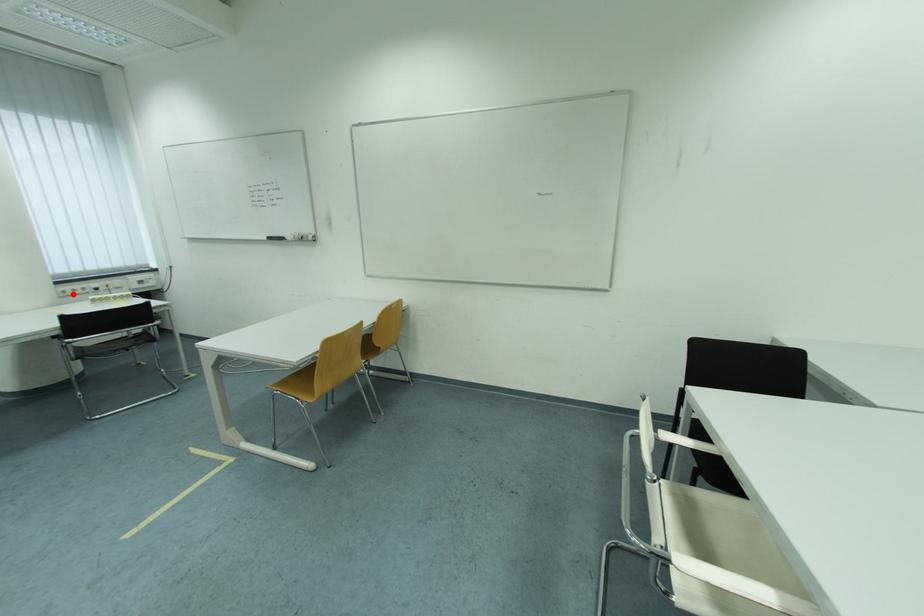
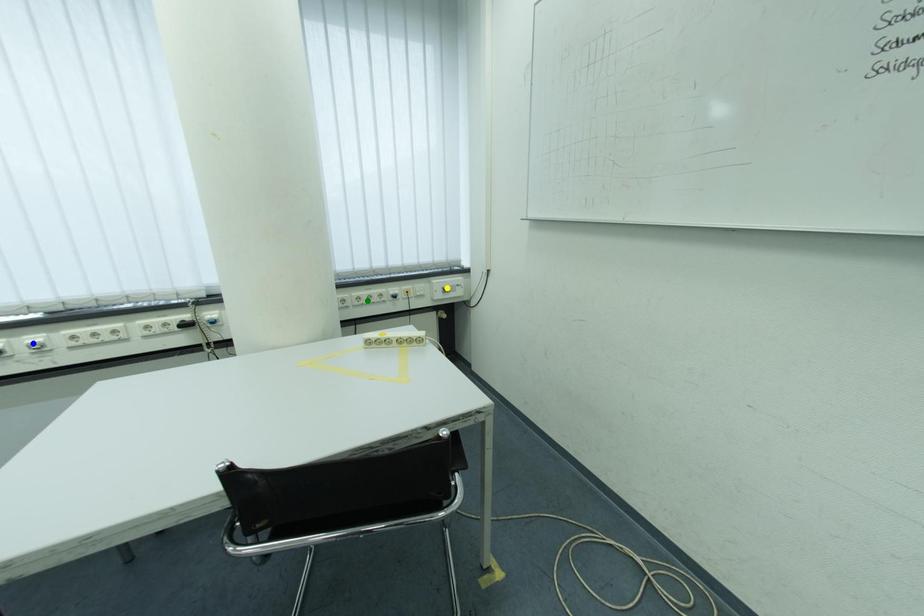
Question: I am providing you with two images of the same scene from different viewpoints. A red point is marked on the first image. You are given multiple points on the second image. Which spot in image 2 lines up with the point in image 1?

Choices:
 (A) yellow point
 (B) green point
 (C) blue point

Answer: (B)